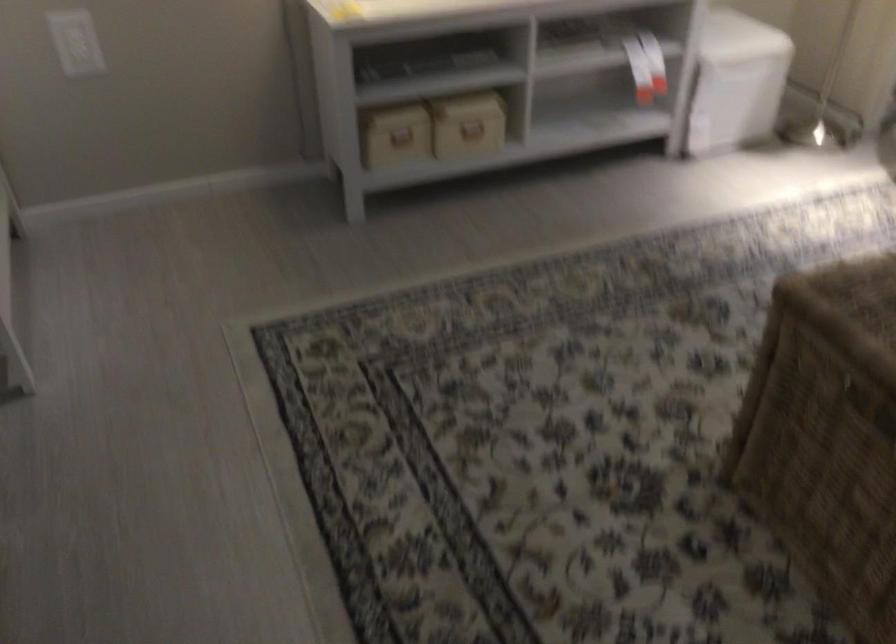
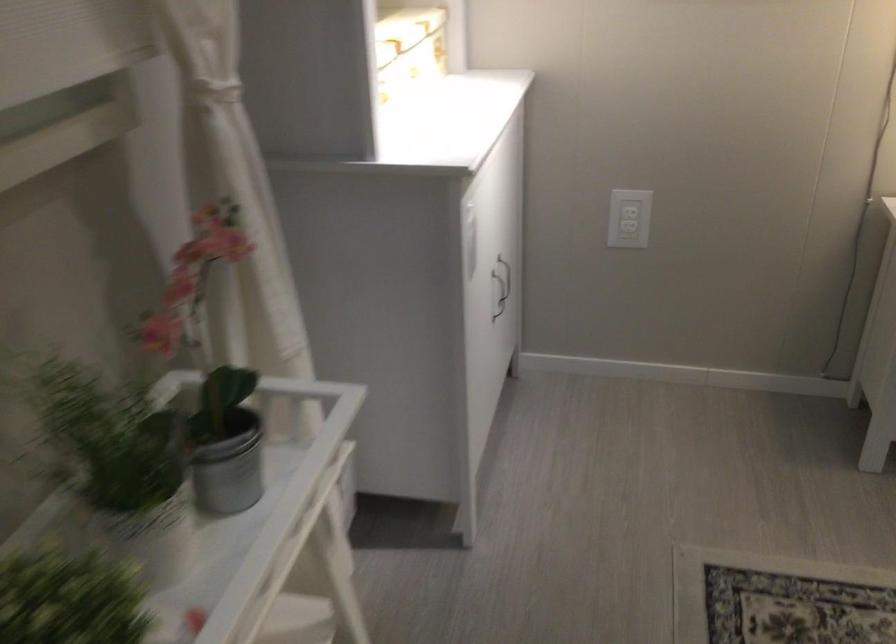
Question: How did the camera likely rotate?

Choices:
 (A) Left
 (B) Right
 (C) Up
 (D) Down

Answer: (A)